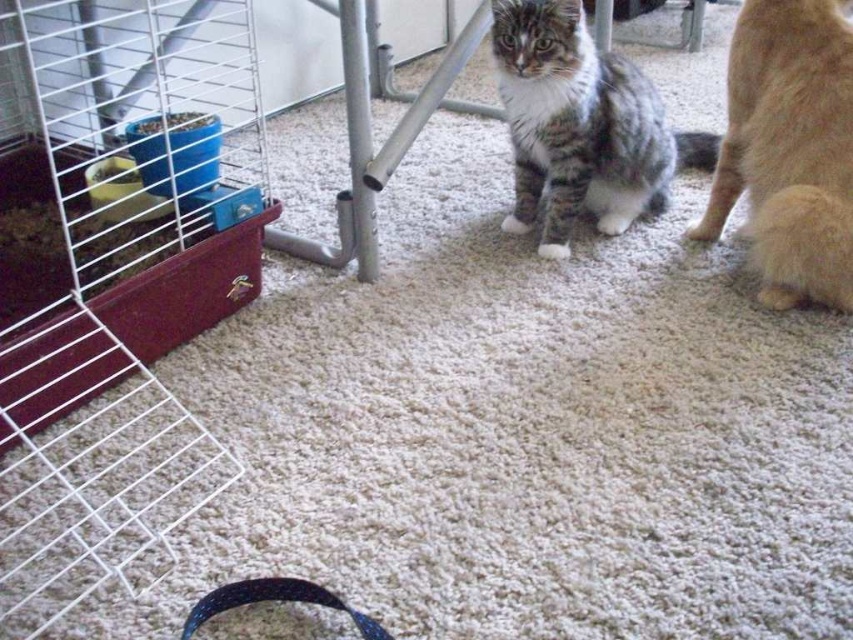
You are a photographer trying to capture both cats in the image. Since the fluffy orange cat at lower right is taller than the tabby fur cat at center, where should you position your camera to ensure both cats are fully visible in the photo?

To ensure both the fluffy orange cat at lower right and the tabby fur cat at center are fully visible, position the camera at a height that accommodates the taller fluffy orange cat at lower right, as it is taller than the tabby fur cat at center.